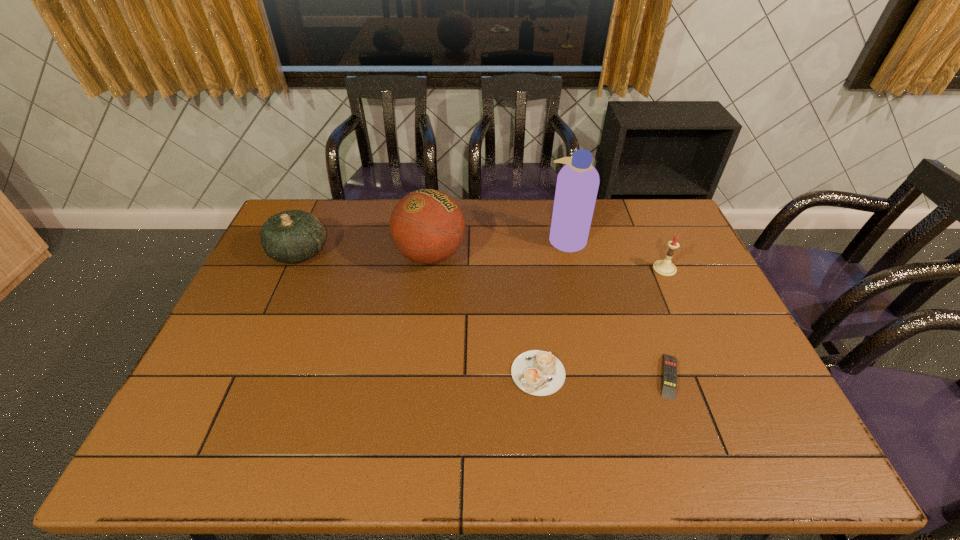
The image size is (960, 540). I want to click on gourd that is at the far edge, so click(x=293, y=236).

Where is `object present at the left edge`? object present at the left edge is located at coordinates (293, 236).

You are a GUI agent. You are given a task and a screenshot of the screen. Output one action in this format:
    pyautogui.click(x=<x>, y=<y>)
    Task: Click on the object that is at the right edge
    Image resolution: width=960 pixels, height=540 pixels.
    Given the screenshot: What is the action you would take?
    pyautogui.click(x=664, y=267)

Image resolution: width=960 pixels, height=540 pixels. I want to click on object situated at the far left corner, so click(293, 236).

The image size is (960, 540). In the image, there is a desktop. What are the coordinates of `vacant region at the far edge` in the screenshot? It's located at (529, 236).

You are a GUI agent. You are given a task and a screenshot of the screen. Output one action in this format:
    pyautogui.click(x=<x>, y=<y>)
    Task: Click on the vacant space at the near edge
    
    Given the screenshot: What is the action you would take?
    pyautogui.click(x=660, y=443)

Locate an element on the screen. This screenshot has width=960, height=540. vacant space at the left edge is located at coordinates (224, 407).

Where is `blank space at the right edge`? The height and width of the screenshot is (540, 960). blank space at the right edge is located at coordinates (766, 396).

Where is `vacant space at the far right corner`? vacant space at the far right corner is located at coordinates (659, 235).

Where is `unoccupied position between the shortest object and the fifth tallest object`? This screenshot has width=960, height=540. unoccupied position between the shortest object and the fifth tallest object is located at coordinates (604, 375).